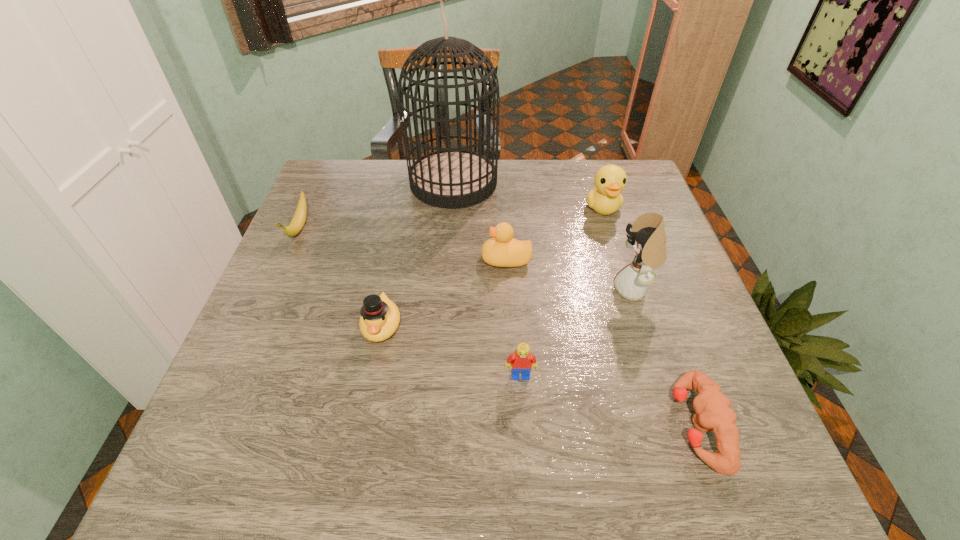
You are a GUI agent. You are given a task and a screenshot of the screen. Output one action in this format:
    pyautogui.click(x=<x>, y=<y>)
    Task: Click on the free space that is in between the shortest object and the second duck from left to right
    
    Given the screenshot: What is the action you would take?
    pyautogui.click(x=601, y=342)

Find the location of a particular element. This screenshot has width=960, height=540. free area in between the leftmost object and the birdcage is located at coordinates (376, 206).

Find the location of a particular element. free space between the rightmost duck and the tallest object is located at coordinates [x=528, y=195].

Where is `vacant area that lies between the birdcage and the second nearest duck`? vacant area that lies between the birdcage and the second nearest duck is located at coordinates (480, 221).

Find the location of a particular element. This screenshot has height=540, width=960. free space between the second tallest object and the leftmost object is located at coordinates (467, 259).

This screenshot has height=540, width=960. In order to click on free spot between the farthest duck and the shortest object in this screenshot , I will do `click(650, 316)`.

The width and height of the screenshot is (960, 540). In order to click on free space between the birdcage and the nearest duck in this screenshot , I will do `click(418, 254)`.

At what (x,y) coordinates should I click in order to perform the action: click on empty location between the seventh shortest object and the banana. Please return your answer as a coordinate pair (x, y). This screenshot has height=540, width=960. Looking at the image, I should click on (467, 259).

This screenshot has height=540, width=960. What are the coordinates of `vacant point located between the Lego and the banana` in the screenshot? It's located at (410, 302).

Choose which object is the seventh nearest neighbor to the nearest duck. Please provide its 2D coordinates. Your answer should be formatted as a tuple, i.e. [(x, y)], where the tuple contains the x and y coordinates of a point satisfying the conditions above.

[(605, 198)]